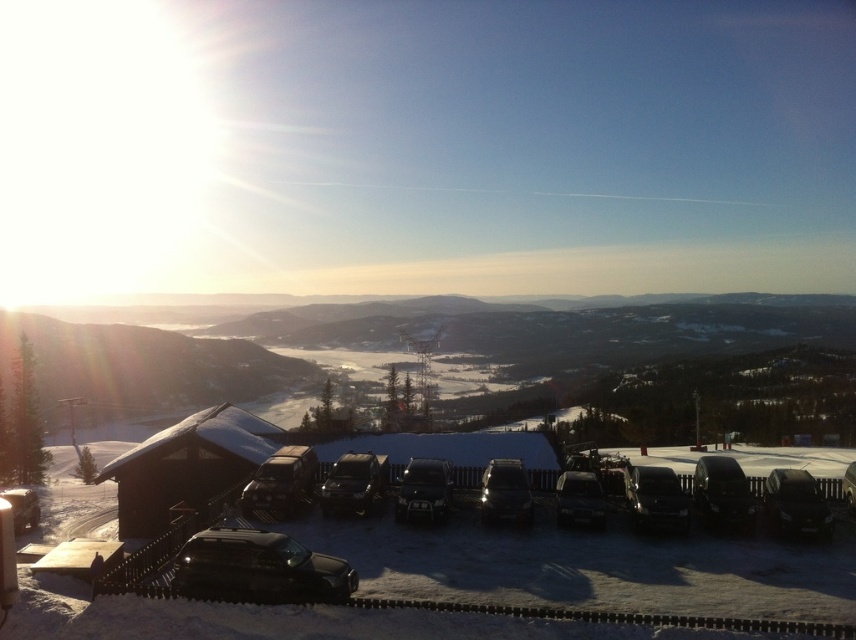
Question: Can you confirm if black metallic car at center is positioned to the right of metallic silver suv at center?

Choices:
 (A) yes
 (B) no

Answer: (A)

Question: Estimate the real-world distances between objects in this image. Which object is closer to the metallic silver car at center?

Choices:
 (A) matte black suv at lower left
 (B) metallic silver suv at center
 (C) brown wooden hut at lower left

Answer: (B)

Question: Does metallic silver suv at center have a greater width compared to satin black car at lower right?

Choices:
 (A) yes
 (B) no

Answer: (A)

Question: Is brown wooden hut at lower left positioned at the back of glossy black suv at lower center?

Choices:
 (A) no
 (B) yes

Answer: (B)

Question: Among these points, which one is farthest from the camera?

Choices:
 (A) (358, 474)
 (B) (742, 484)
 (C) (822, 497)
 (D) (655, 486)

Answer: (A)

Question: Which of the following is the closest to the observer?

Choices:
 (A) black matte cars at center
 (B) matte black suv at lower left
 (C) metallic silver car at center

Answer: (A)